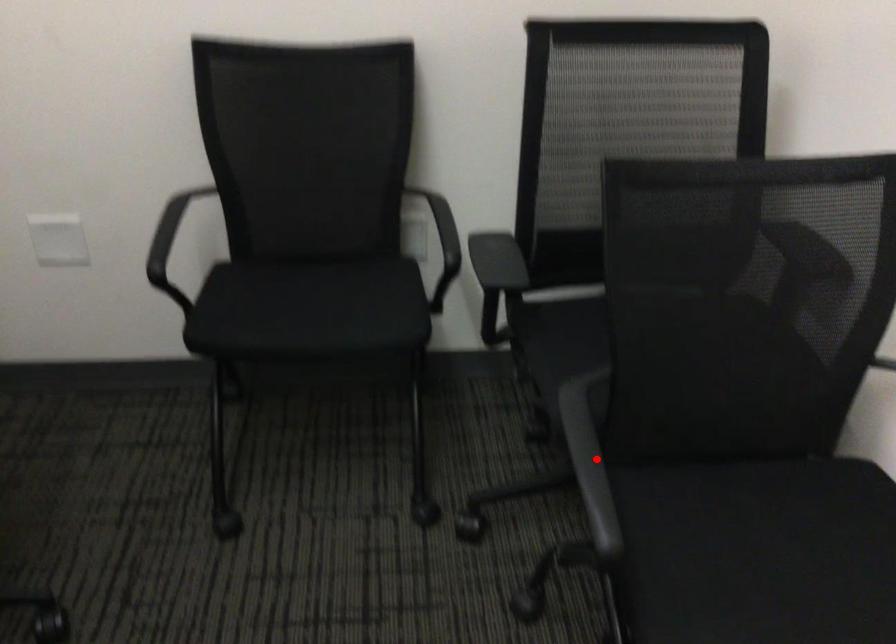
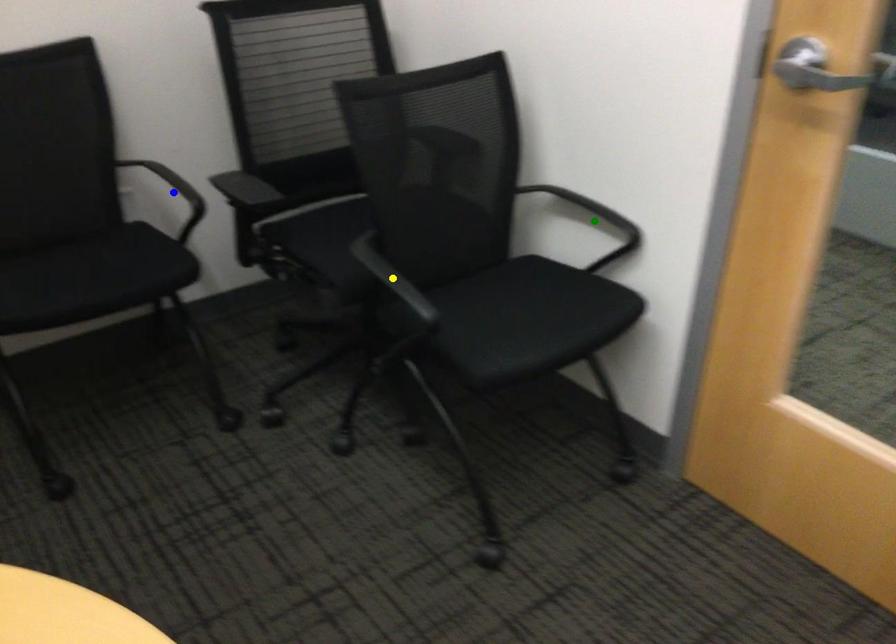
Question: I am providing you with two images of the same scene from different viewpoints. A red point is marked on the first image. You are given multiple points on the second image. Which point in image 2 is actually the same real-world point as the red point in image 1?

Choices:
 (A) blue point
 (B) yellow point
 (C) green point

Answer: (B)